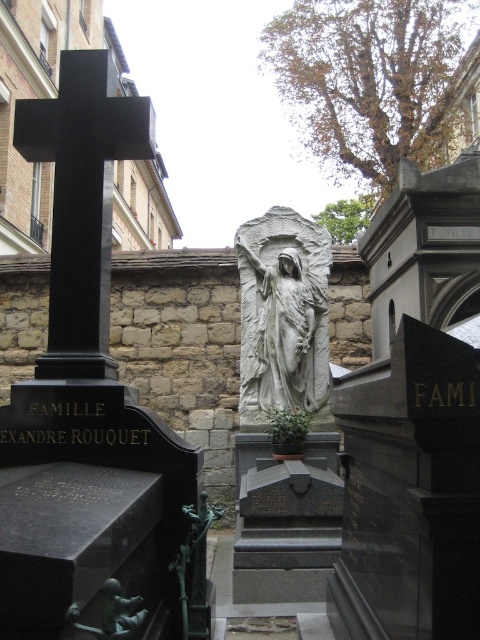
Does white stone statue at center appear over green patina statue at lower center?

Yes.

Is white stone statue at center positioned before green patina statue at lower center?

No, white stone statue at center is behind green patina statue at lower center.

Does point (302, 316) come in front of point (116, 600)?

No, (302, 316) is further to viewer.

The width and height of the screenshot is (480, 640). Find the location of `white stone statue at center`. white stone statue at center is located at coordinates (284, 316).

Can you confirm if black polished stone cross at upper left is shorter than green patina statue at lower center?

No.

Is black polished stone cross at upper left positioned behind green patina statue at lower center?

Yes, black polished stone cross at upper left is further from the viewer.

Does point (26, 122) lie behind point (113, 628)?

Yes, point (26, 122) is behind point (113, 628).

Find the location of a particular element. This screenshot has width=480, height=640. black polished stone cross at upper left is located at coordinates (82, 202).

What do you see at coordinates (82, 202) in the screenshot? I see `black polished stone cross at upper left` at bounding box center [82, 202].

The height and width of the screenshot is (640, 480). What do you see at coordinates (82, 202) in the screenshot?
I see `black polished stone cross at upper left` at bounding box center [82, 202].

You are a GUI agent. You are given a task and a screenshot of the screen. Output one action in this format:
    pyautogui.click(x=<x>, y=<y>)
    Task: Click on the black polished stone cross at upper left
    
    Given the screenshot: What is the action you would take?
    pyautogui.click(x=82, y=202)